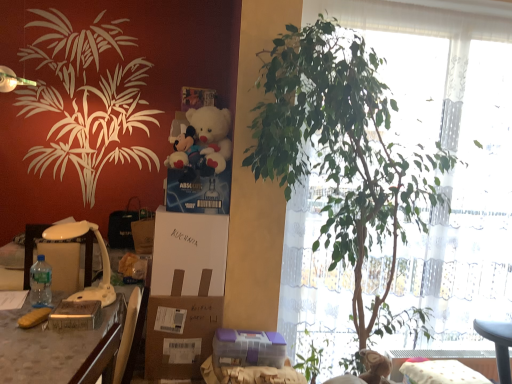
Question: In terms of width, does clear plastic bottle at left look wider or thinner when compared to brown cardboard box at center?

Choices:
 (A) thin
 (B) wide

Answer: (A)

Question: Does point (40, 274) appear closer or farther from the camera than point (147, 347)?

Choices:
 (A) closer
 (B) farther

Answer: (B)

Question: Which object is the farthest from the brown cardboard box at center?

Choices:
 (A) clear plastic bottle at left
 (B) wooden desk at left
 (C) purple plastic container at lower center, positioned as the 2th gift in front-to-back order
 (D) green leafy plant at center
 (E) white plush teddy bear at upper center

Answer: (D)

Question: Which object is the closest to the wooden desk at left?

Choices:
 (A) clear plastic bottle at left
 (B) metallic gold box at lower left, arranged as the 2th gift when viewed from the right
 (C) white plush teddy bear at upper center
 (D) purple plastic container at lower center, marked as the 2th gift in a top-to-bottom arrangement
 (E) white plastic lamp at left

Answer: (B)